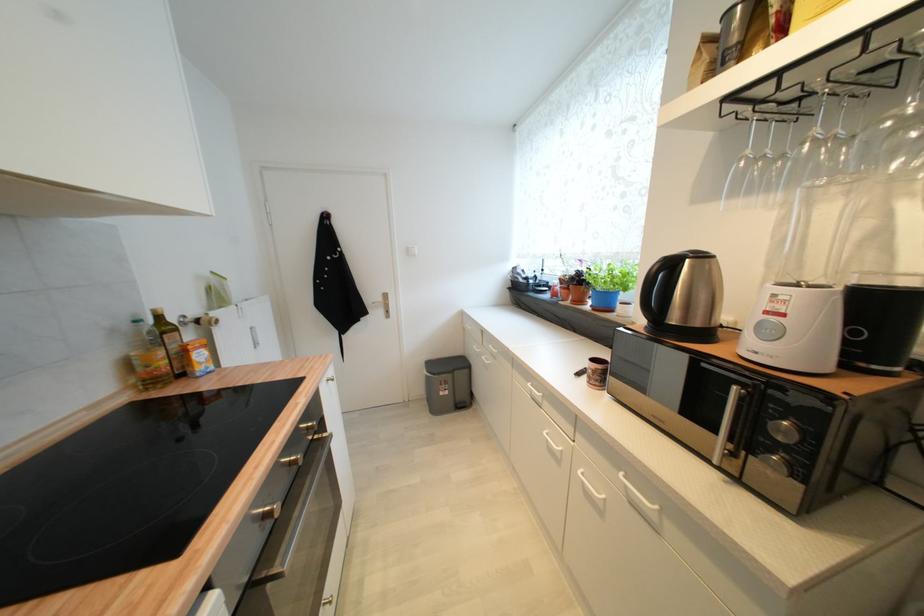
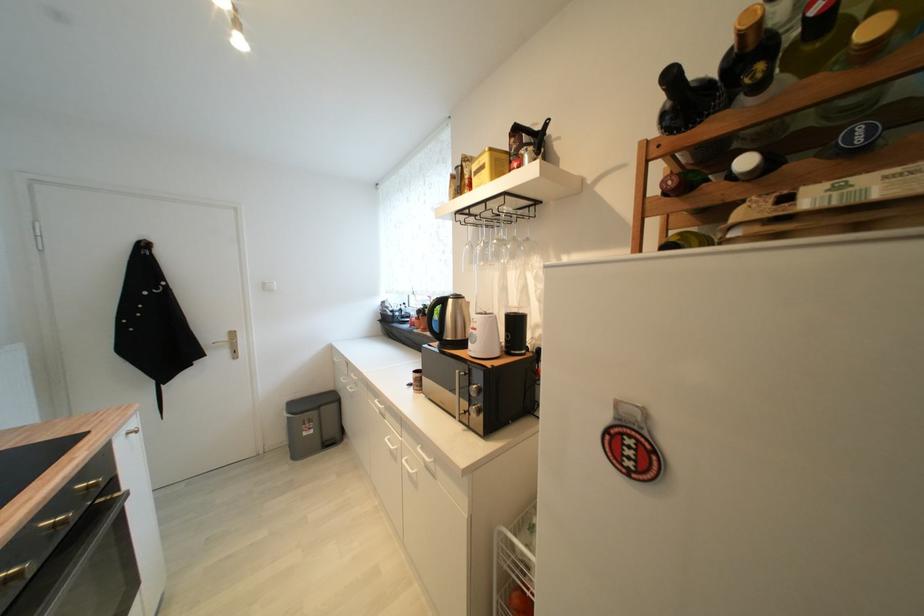
Find the pixel in the second image that matches point (584, 275) in the first image.

(431, 309)